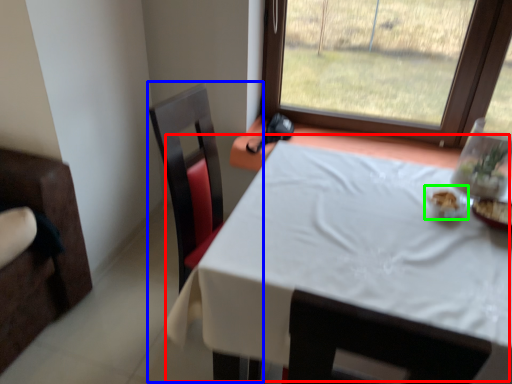
Question: Which object is the farthest from table (highlighted by a red box)? Choose among these: swivel chair (highlighted by a blue box) or tableware (highlighted by a green box).

Choices:
 (A) swivel chair
 (B) tableware

Answer: (A)